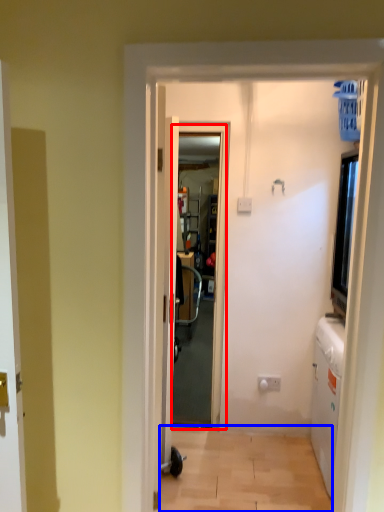
Question: Which object is closer to the camera taking this photo, screen door (highlighted by a red box) or corridor (highlighted by a blue box)?

Choices:
 (A) screen door
 (B) corridor

Answer: (B)